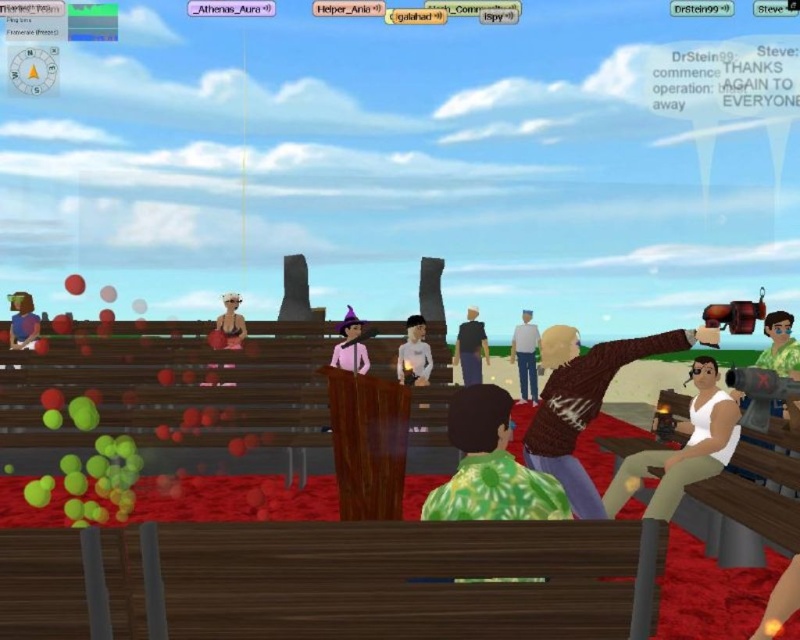
You are a guest at an outdoor event and want to sit down. You see a wooden bench at lower right and a matte pink dress at center. Which object is located to the right side of the scene?

The wooden bench at lower right is located to the right of the matte pink dress at center, so the wooden bench at lower right is on the right side of the scene.

You are standing in the audience area looking towards the podium. There are two points marked in the scene. The first point is at coordinates point (388, 618) and the second point is at coordinates point (780, 333). Which point is closer to you?

Point (388, 618) is closer to the camera than point (780, 333), so the first point is closer to you.